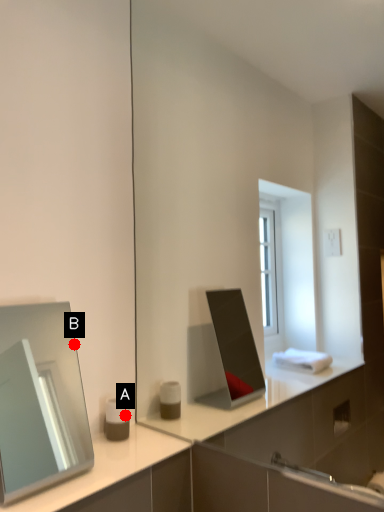
Question: Two points are circled on the image, labeled by A and B beside each circle. Among these points, which one is farthest from the camera?

Choices:
 (A) A is further
 (B) B is further

Answer: (B)